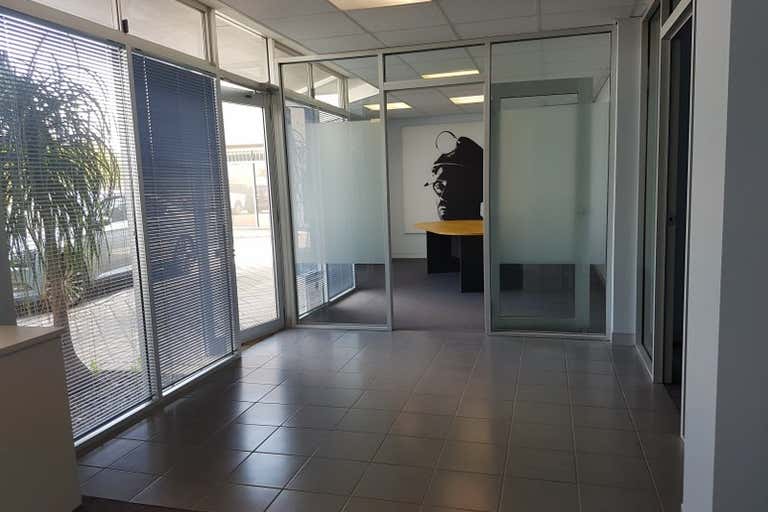
The height and width of the screenshot is (512, 768). In order to click on floor to ceiling windows to outside in this screenshot , I will do `click(93, 306)`, `click(173, 283)`, `click(246, 182)`, `click(309, 287)`, `click(346, 285)`, `click(323, 84)`, `click(300, 76)`, `click(250, 67)`, `click(203, 55)`.